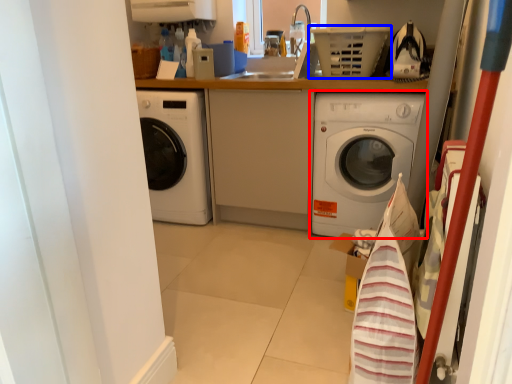
Question: Which point is further to the camera, washing machine (highlighted by a red box) or basket (highlighted by a blue box)?

Choices:
 (A) washing machine
 (B) basket

Answer: (A)